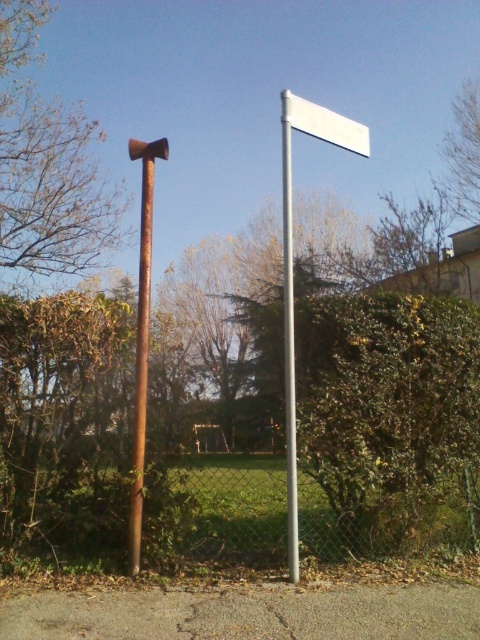
Does rusty metal pole at left appear on the left side of white plastic sign at upper center?

Indeed, rusty metal pole at left is positioned on the left side of white plastic sign at upper center.

Is point (136, 548) in front of point (359, 144)?

Yes, point (136, 548) is closer to viewer.

Is point (139, 364) positioned behind point (336, 122)?

That is False.

I want to click on rusty metal pole at left, so click(x=142, y=337).

Can you confirm if silver metallic signpost at center is wider than white plastic sign at upper center?

A: No, silver metallic signpost at center is not wider than white plastic sign at upper center.

Between silver metallic signpost at center and white plastic sign at upper center, which one appears on the right side from the viewer's perspective?

From the viewer's perspective, white plastic sign at upper center appears more on the right side.

Who is more forward, (280, 115) or (326, 134)?

Point (326, 134) is more forward.

The image size is (480, 640). In order to click on silver metallic signpost at center in this screenshot , I will do `click(288, 340)`.

Between point (136, 572) and point (284, 93), which one is positioned in front?

Point (136, 572) is more forward.

Locate an element on the screen. The width and height of the screenshot is (480, 640). rusty metal pole at left is located at coordinates (142, 337).